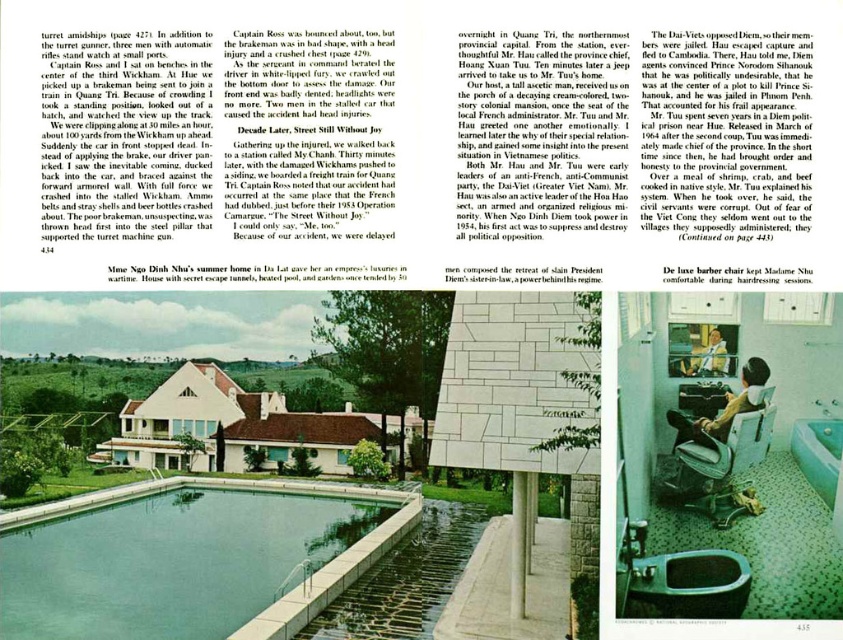
You are a guest at this house and need to locate the bathroom. You see a matte porcelain toilet bowl at lower center and a light brown wooden chair at lower center. Which object indicates the bathroom location?

The matte porcelain toilet bowl at lower center indicates the bathroom location as toilets are typically found there.

You are a guest at this house and need to locate the bathroom. You see the matte porcelain toilet bowl at lower center and the light brown wooden chair at lower center. Which object is closer to you?

The matte porcelain toilet bowl at lower center is closer to the viewer than the light brown wooden chair at lower center.

Consider the image. You are a guest staying in the house and need to locate the bathroom. You see the matte porcelain toilet bowl at lower center and the smooth wooden chair at lower right. Which direction should you move to reach the bathroom?

The matte porcelain toilet bowl at lower center is to the left of the smooth wooden chair at lower right, so you should move towards the left side to reach the bathroom.